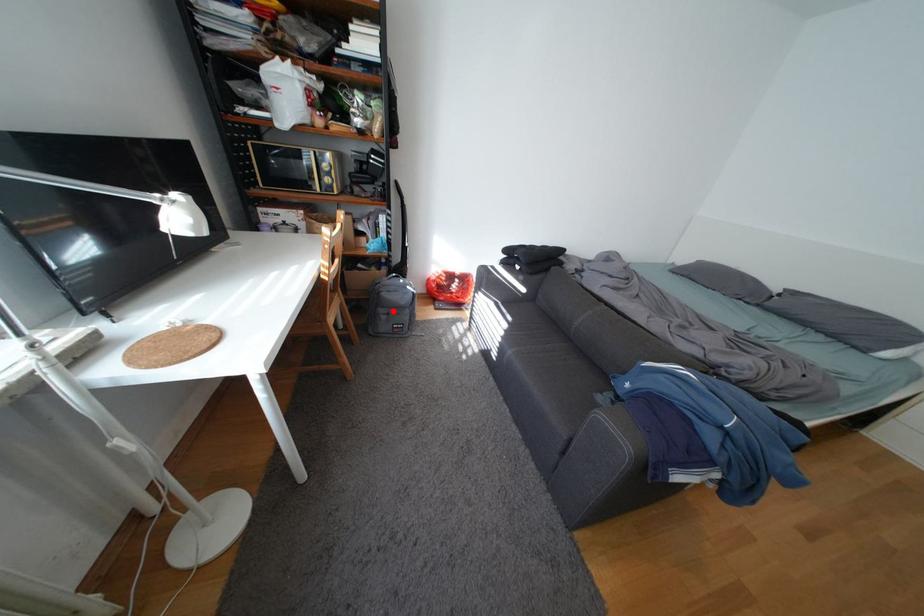
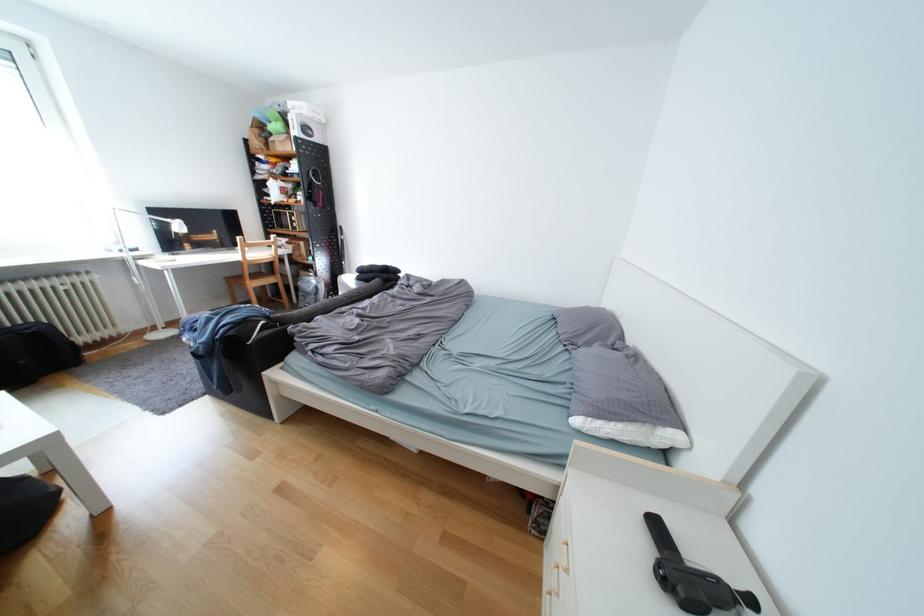
In the second image, find the point that corresponds to the highlighted location in the first image.

(313, 294)